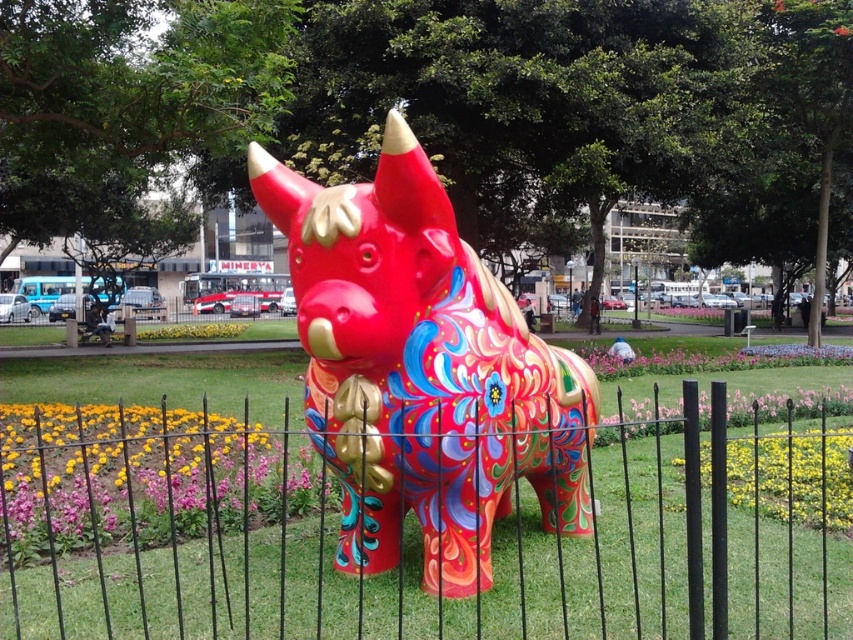
Is point (144, 515) more distant than point (837, 512)?

No, (144, 515) is in front of (837, 512).

Is purple matte flower at center above yellow matte flower at center?

Yes, purple matte flower at center is above yellow matte flower at center.

This screenshot has width=853, height=640. What do you see at coordinates (131, 472) in the screenshot?
I see `purple matte flower at center` at bounding box center [131, 472].

Find the location of a particular element. This screenshot has height=640, width=853. purple matte flower at center is located at coordinates (131, 472).

Can you confirm if black metal fence at center is positioned above shiny plastic bull at center?

No.

Between black metal fence at center and shiny plastic bull at center, which one appears on the right side from the viewer's perspective?

black metal fence at center

Locate an element on the screen. black metal fence at center is located at coordinates (412, 532).

Can you confirm if shiny plastic bull at center is positioned to the right of purple matte flower at center?

Indeed, shiny plastic bull at center is positioned on the right side of purple matte flower at center.

Does shiny plastic bull at center have a greater height compared to purple matte flower at center?

Yes.

Where is `shiny plastic bull at center`? shiny plastic bull at center is located at coordinates (421, 369).